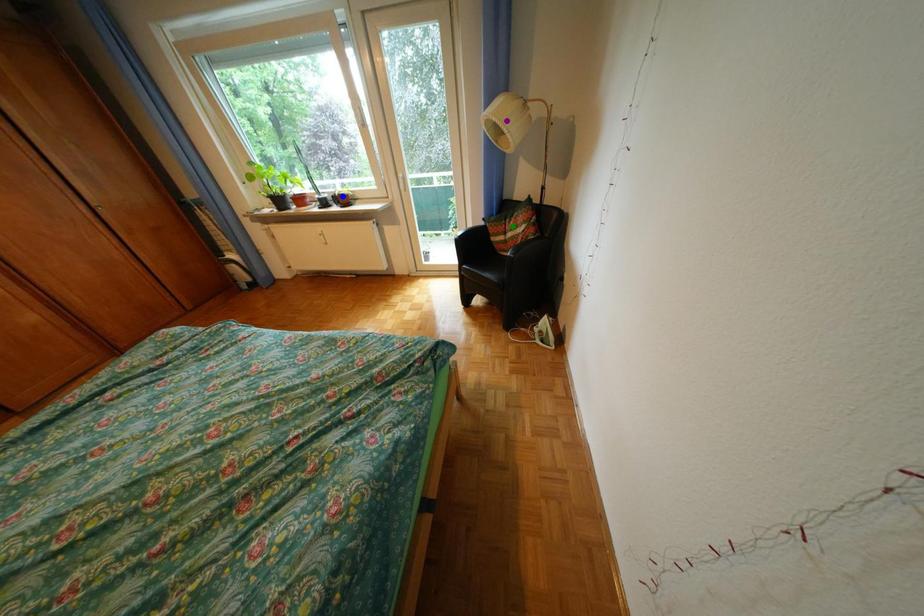
Order these from nearest to farthest:
A) purple point
B) blue point
C) green point

1. purple point
2. green point
3. blue point